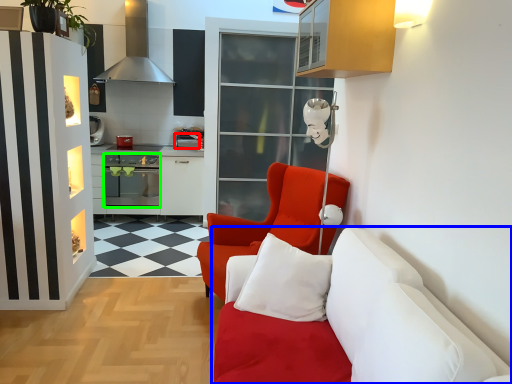
Question: Estimate the real-world distances between objects in this image. Which object is closer to appliance (highlighted by a red box), studio couch (highlighted by a blue box) or oven (highlighted by a green box)?

Choices:
 (A) studio couch
 (B) oven

Answer: (B)